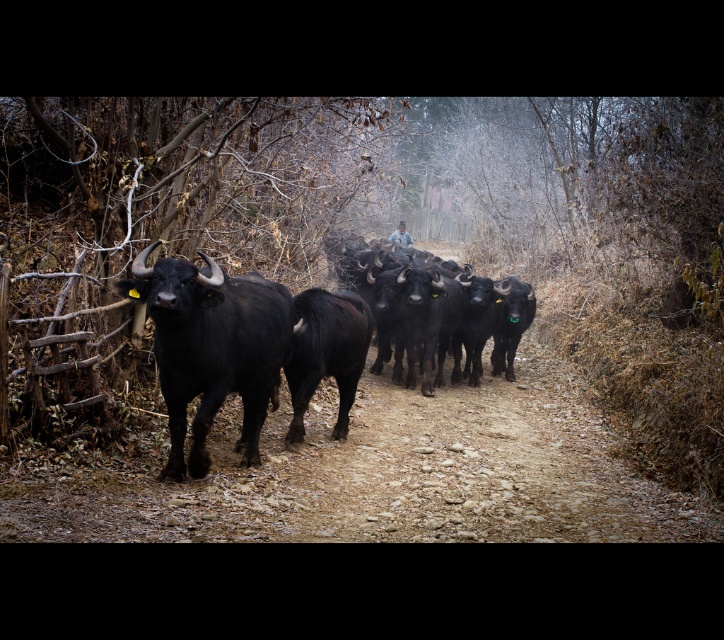
Between black glossy buffalo at center and black shaggy bull at center, which one is positioned lower?

black glossy buffalo at center

How far apart are black glossy buffalo at center and black shaggy bull at center?

black glossy buffalo at center and black shaggy bull at center are 9.50 inches apart.

This screenshot has width=724, height=640. I want to click on black glossy buffalo at center, so click(x=243, y=349).

Can you confirm if shiny black bull at center is positioned to the left of black shaggy bull at center?

Yes, shiny black bull at center is to the left of black shaggy bull at center.

Between shiny black bull at center and black shaggy bull at center, which one appears on the right side from the viewer's perspective?

From the viewer's perspective, black shaggy bull at center appears more on the right side.

Is point (190, 352) closer to viewer compared to point (345, 396)?

Yes, point (190, 352) is in front of point (345, 396).

I want to click on shiny black bull at center, so click(211, 348).

Between black glossy buffalo at center and shiny black bull at center, which one is positioned higher?

shiny black bull at center is above.

Between point (185, 374) and point (143, 278), which one is positioned in front?

Point (143, 278) is in front.

The width and height of the screenshot is (724, 640). What are the coordinates of `black glossy buffalo at center` in the screenshot? It's located at (243, 349).